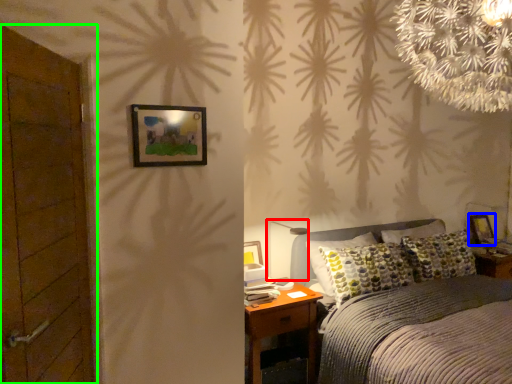
Question: Which is nearer to the table lamp (highlighted by a red box)? picture frame (highlighted by a blue box) or door (highlighted by a green box).

Choices:
 (A) picture frame
 (B) door

Answer: (B)